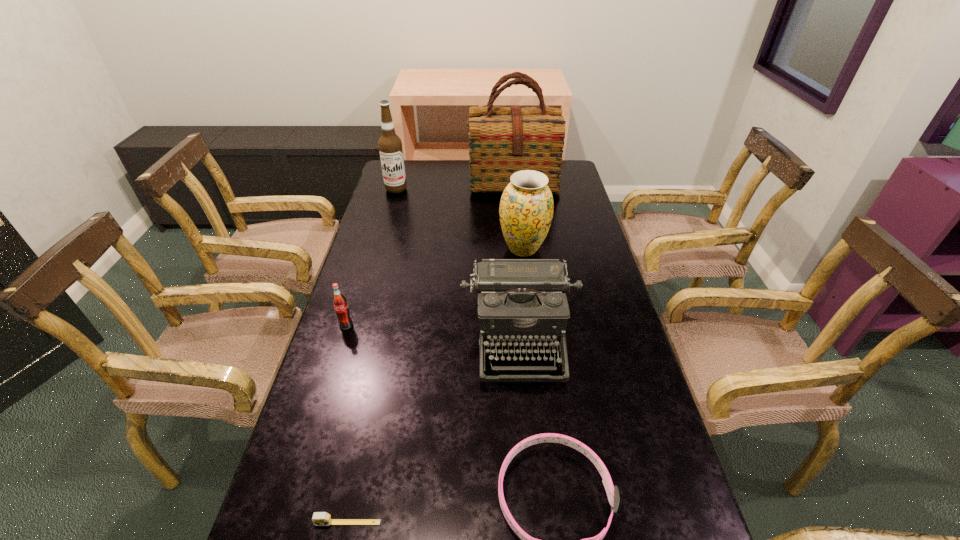
Where is `object that is at the far right corner`? This screenshot has height=540, width=960. object that is at the far right corner is located at coordinates (502, 140).

The image size is (960, 540). I want to click on free space at the far edge, so click(453, 186).

In order to click on free space at the left edge of the desktop in this screenshot , I will do `click(318, 449)`.

At what (x,y) coordinates should I click in order to perform the action: click on vacant region at the right edge of the desktop. Please return your answer as a coordinate pair (x, y). Looking at the image, I should click on (645, 482).

Locate an element on the screen. Image resolution: width=960 pixels, height=540 pixels. free space at the far left corner is located at coordinates (420, 183).

At what (x,y) coordinates should I click in order to perform the action: click on vacant area at the far right corner. Please return your answer as a coordinate pair (x, y). Image resolution: width=960 pixels, height=540 pixels. Looking at the image, I should click on (571, 166).

I want to click on unoccupied area between the sixth shortest object and the shortest object, so click(x=372, y=356).

This screenshot has height=540, width=960. I want to click on free space between the second tallest object and the shortest object, so click(372, 356).

Locate an element on the screen. The width and height of the screenshot is (960, 540). vacant space that is in between the second tallest object and the third shortest object is located at coordinates (372, 257).

Image resolution: width=960 pixels, height=540 pixels. Find the location of `vacant region between the tape measure and the tallest object`. vacant region between the tape measure and the tallest object is located at coordinates (430, 353).